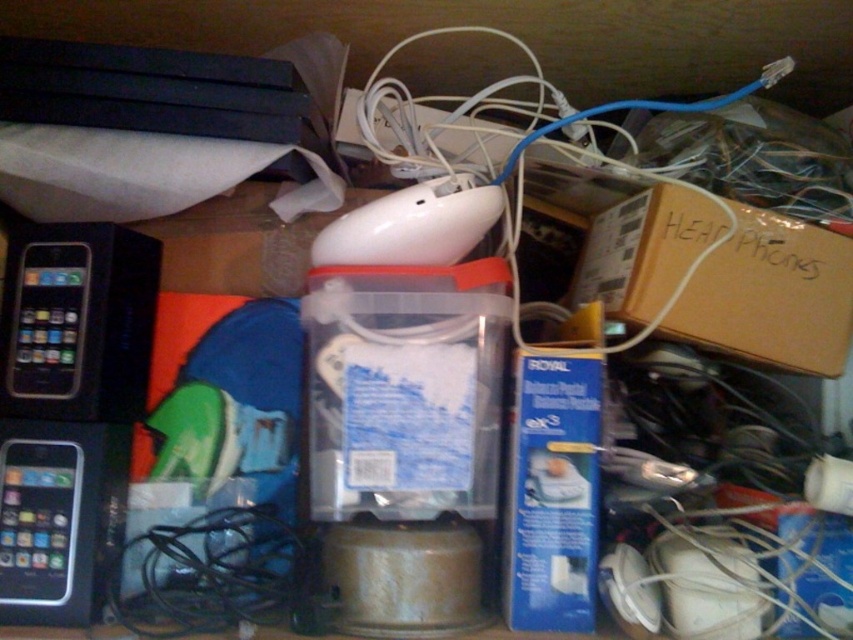
You are organizing the storage area and need to locate the black glossy iphone at left and the blue cable at center. Based on their positions, which item is closer to the ground?

The black glossy iphone at left is closer to the ground because it is positioned below the blue cable at center.

You are a technician trying to locate the blue cable at center to connect it to the black glossy iphone at left. Given that the minimum required distance for a safe connection is 12 inches, can you safely connect them without moving either device?

The distance between the black glossy iphone at left and the blue cable at center is 13.89 inches, which exceeds the minimum required 12 inches. Therefore, you can safely connect them without moving either device.